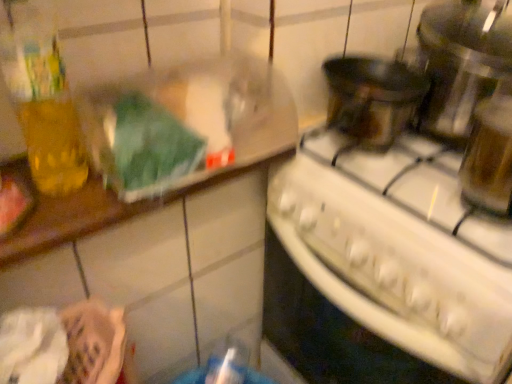
Question: From a real-world perspective, is white glossy stove at center physically above metallic silver pot at upper right?

Choices:
 (A) no
 (B) yes

Answer: (A)

Question: From the image's perspective, is white glossy stove at center beneath metallic silver pot at upper right?

Choices:
 (A) yes
 (B) no

Answer: (A)

Question: Can you confirm if white glossy stove at center is taller than metallic silver pot at upper right?

Choices:
 (A) yes
 (B) no

Answer: (A)

Question: Is white glossy stove at center wider than metallic silver pot at upper right?

Choices:
 (A) yes
 (B) no

Answer: (A)

Question: Is white glossy stove at center at the left side of metallic silver pot at upper right?

Choices:
 (A) no
 (B) yes

Answer: (B)

Question: Is white glossy stove at center oriented towards metallic silver pot at upper right?

Choices:
 (A) no
 (B) yes

Answer: (A)

Question: Considering the relative positions of metallic silver pot at upper right and white glossy stove at center in the image provided, is metallic silver pot at upper right in front of white glossy stove at center?

Choices:
 (A) yes
 (B) no

Answer: (B)

Question: Is white glossy stove at center at the back of metallic silver pot at upper right?

Choices:
 (A) no
 (B) yes

Answer: (A)

Question: From a real-world perspective, does metallic silver pot at upper right sit lower than white glossy stove at center?

Choices:
 (A) yes
 (B) no

Answer: (B)

Question: Considering the relative sizes of metallic silver pot at upper right and white glossy stove at center in the image provided, is metallic silver pot at upper right taller than white glossy stove at center?

Choices:
 (A) no
 (B) yes

Answer: (A)

Question: Considering the relative positions of metallic silver pot at upper right and white glossy stove at center in the image provided, is metallic silver pot at upper right to the left of white glossy stove at center from the viewer's perspective?

Choices:
 (A) no
 (B) yes

Answer: (A)

Question: From the image's perspective, does metallic silver pot at upper right appear higher than white glossy stove at center?

Choices:
 (A) yes
 (B) no

Answer: (A)

Question: Is metallic silver pot at upper right wider or thinner than white glossy stove at center?

Choices:
 (A) wide
 (B) thin

Answer: (B)